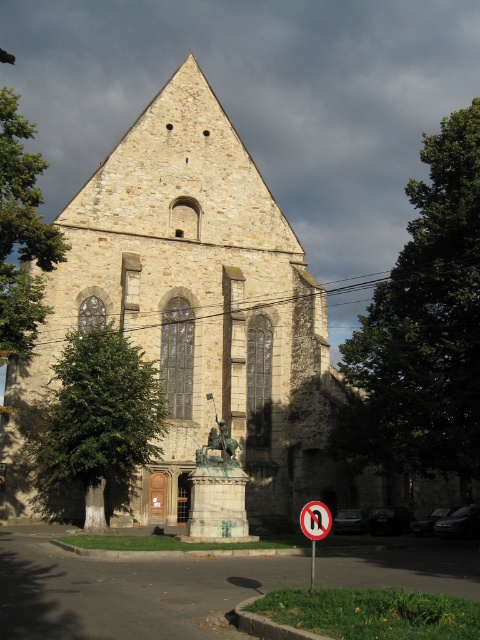
Question: In this image, where is white plastic no u-turn sign at lower right located relative to black plastic sign at center?

Choices:
 (A) left
 (B) right

Answer: (B)

Question: Can you confirm if white plastic no u-turn sign at lower right is wider than black plastic sign at center?

Choices:
 (A) no
 (B) yes

Answer: (B)

Question: From the image, what is the correct spatial relationship of stone church at center in relation to black plastic sign at center?

Choices:
 (A) above
 (B) below

Answer: (A)

Question: Based on their relative distances, which object is farther from the black plastic sign at center?

Choices:
 (A) stone church at center
 (B) white plastic no u-turn sign at lower right

Answer: (A)

Question: Which point is farther to the camera?

Choices:
 (A) (324, 518)
 (B) (226, 243)
 (C) (324, 522)

Answer: (B)

Question: Which of the following is the closest to the observer?

Choices:
 (A) stone church at center
 (B) black plastic sign at center

Answer: (B)